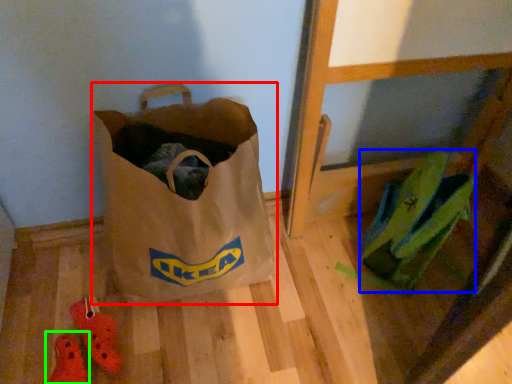
Question: Which object is the closest to the luggage and bags (highlighted by a red box)? Choose among these: grocery bag (highlighted by a blue box) or footwear (highlighted by a green box).

Choices:
 (A) grocery bag
 (B) footwear

Answer: (B)